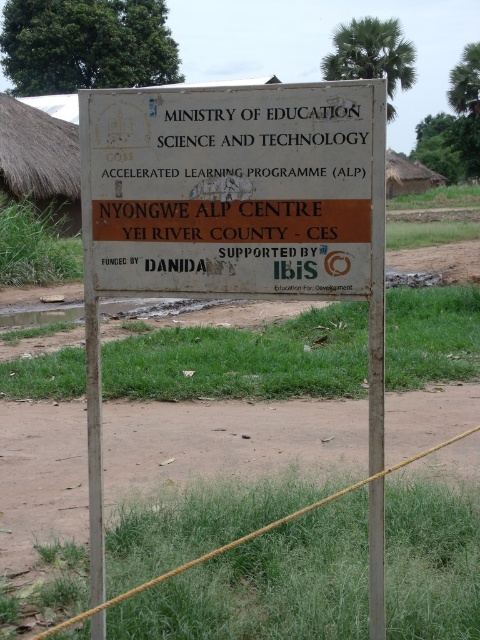
Is point (149, 252) positioned in front of point (197, 120)?

No, it is not.

Who is more forward, (98, 356) or (310, 104)?

Point (310, 104)

What do you see at coordinates (231, 212) in the screenshot?
I see `white wooden sign at center` at bounding box center [231, 212].

Find the location of a particular element. This screenshot has width=480, height=640. white wooden sign at center is located at coordinates (231, 212).